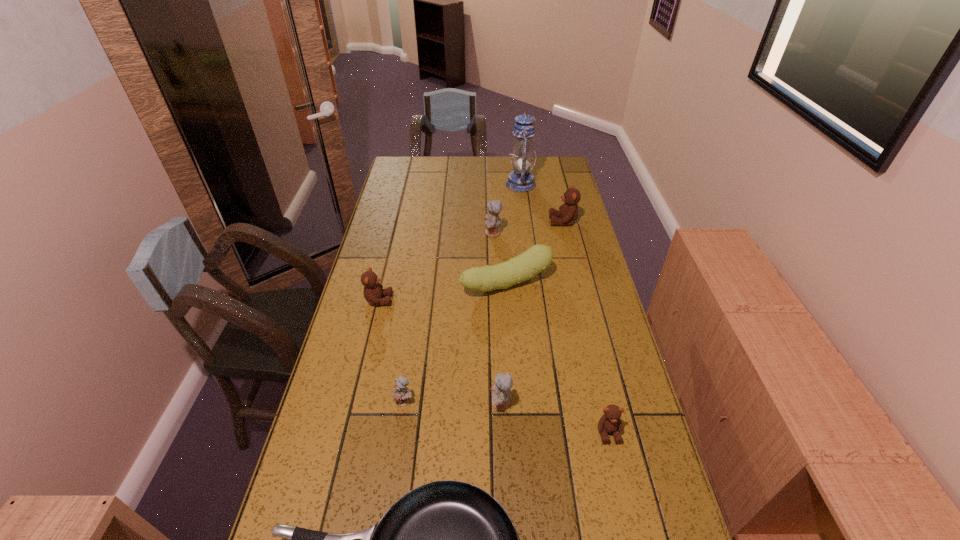
In order to click on the tallest object in this screenshot , I will do `click(521, 179)`.

At what (x,y) coordinates should I click in order to perform the action: click on the farthest object. Please return your answer as a coordinate pair (x, y). Looking at the image, I should click on (521, 179).

Locate an element on the screen. the farthest blue teddy bear is located at coordinates (492, 220).

What are the coordinates of `the farthest brown teddy bear` in the screenshot? It's located at (568, 213).

Find the location of a particular element. This screenshot has width=960, height=540. green cucumber is located at coordinates (525, 266).

Find the location of `the leftmost brown teddy bear`. the leftmost brown teddy bear is located at coordinates (373, 291).

This screenshot has width=960, height=540. Find the location of `the third farthest teddy bear`. the third farthest teddy bear is located at coordinates (373, 291).

At what (x,y) coordinates should I click in order to perform the action: click on the second biggest blue teddy bear. Please return your answer as a coordinate pair (x, y). Image resolution: width=960 pixels, height=540 pixels. Looking at the image, I should click on (501, 387).

Find the location of a particular element. The width and height of the screenshot is (960, 540). the smallest blue teddy bear is located at coordinates (402, 395).

Where is `the leftmost blue teddy bear`? The image size is (960, 540). the leftmost blue teddy bear is located at coordinates (402, 395).